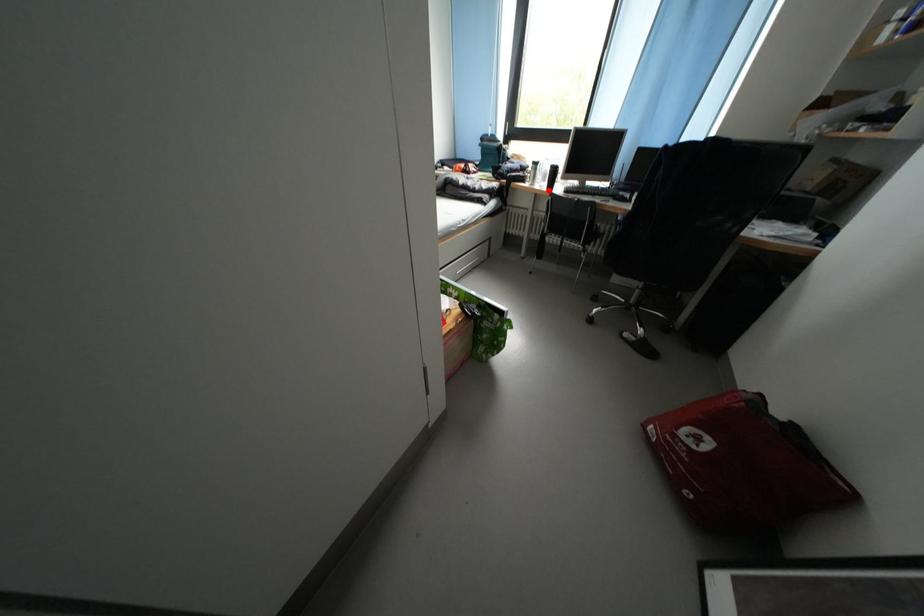
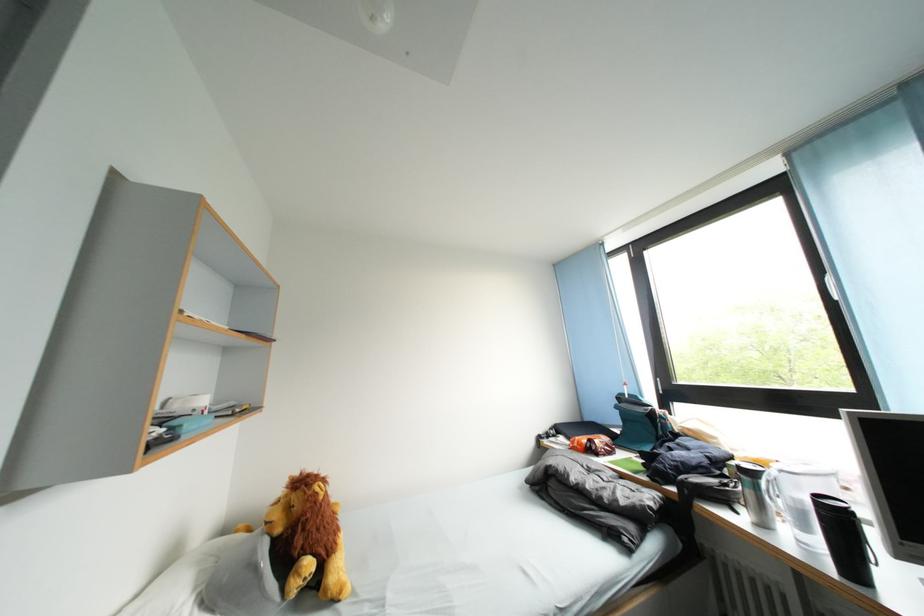
Question: I am providing you with two images of the same scene from different viewpoints. A red point is marked on the first image. Can you still see the location of the red point in image 2?

Choices:
 (A) Yes
 (B) No

Answer: (A)